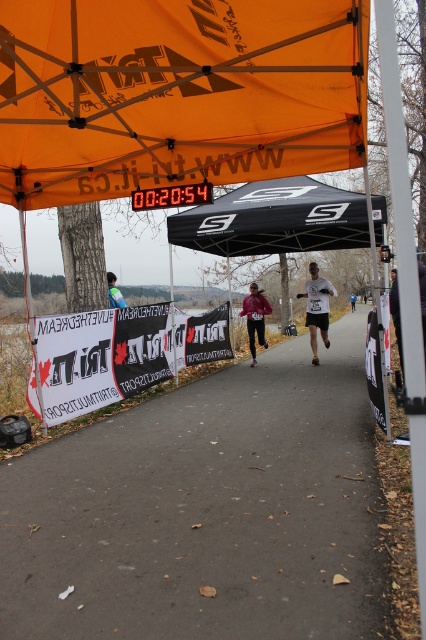
Question: Which point is closer to the camera?

Choices:
 (A) black fabric canopy at center
 (B) white matte running suit at center
 (C) white fabric runner at center

Answer: (A)

Question: Is white matte running suit at center thinner than reflective blue vest at center?

Choices:
 (A) yes
 (B) no

Answer: (A)

Question: Is gray asphalt road at center closer to camera compared to black fabric canopy at center?

Choices:
 (A) yes
 (B) no

Answer: (A)

Question: Does reflective blue vest at center lie behind white fabric runner at center?

Choices:
 (A) yes
 (B) no

Answer: (B)

Question: Which point appears farthest from the camera in this image?

Choices:
 (A) (3, 472)
 (B) (313, 196)
 (C) (262, 323)

Answer: (C)

Question: Estimate the real-world distances between objects in this image. Which object is closer to the orange fabric canopy at upper center?

Choices:
 (A) white fabric runner at center
 (B) black fabric canopy at center
 (C) reflective blue vest at center

Answer: (B)